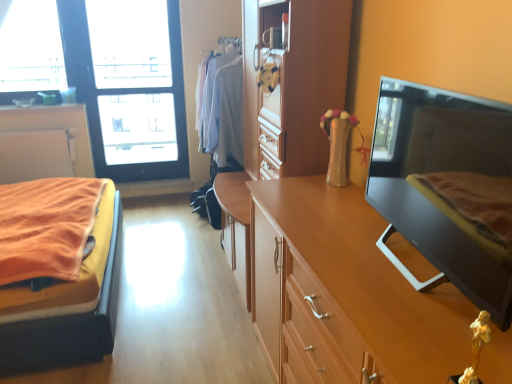
Question: Should I look upward or downward to see black glossy tv at right?

Choices:
 (A) up
 (B) down

Answer: (A)

Question: Does white matte radiator at left, the first cabinetry when ordered from top to bottom, have a greater height compared to black glossy tv at right?

Choices:
 (A) no
 (B) yes

Answer: (A)

Question: Is white matte radiator at left, which is the second cabinetry from bottom to top, behind black glossy tv at right?

Choices:
 (A) no
 (B) yes

Answer: (B)

Question: Is white matte radiator at left, marked as the second cabinetry in a front-to-back arrangement, closer to camera compared to black glossy tv at right?

Choices:
 (A) yes
 (B) no

Answer: (B)

Question: Can you confirm if white matte radiator at left, marked as the second cabinetry in a front-to-back arrangement, is smaller than black glossy tv at right?

Choices:
 (A) yes
 (B) no

Answer: (A)

Question: Is white matte radiator at left, which is the second cabinetry from bottom to top, at the right side of black glossy tv at right?

Choices:
 (A) yes
 (B) no

Answer: (B)

Question: Can you confirm if white matte radiator at left, the first cabinetry when ordered from top to bottom, is thinner than black glossy tv at right?

Choices:
 (A) no
 (B) yes

Answer: (B)

Question: Is transparent glass window at upper left positioned in front of white matte radiator at left, which is the first cabinetry from left to right?

Choices:
 (A) no
 (B) yes

Answer: (A)

Question: Is transparent glass window at upper left oriented towards white matte radiator at left, positioned as the first cabinetry in back-to-front order?

Choices:
 (A) yes
 (B) no

Answer: (B)

Question: Considering the relative sizes of transparent glass window at upper left and white matte radiator at left, the first cabinetry when ordered from top to bottom, in the image provided, is transparent glass window at upper left wider than white matte radiator at left, the first cabinetry when ordered from top to bottom,?

Choices:
 (A) no
 (B) yes

Answer: (B)

Question: Is there a large distance between transparent glass window at upper left and white matte radiator at left, marked as the second cabinetry in a front-to-back arrangement?

Choices:
 (A) no
 (B) yes

Answer: (A)

Question: Is transparent glass window at upper left next to white matte radiator at left, acting as the 2th cabinetry starting from the right?

Choices:
 (A) no
 (B) yes

Answer: (A)

Question: From a real-world perspective, is transparent glass window at upper left positioned over white matte radiator at left, positioned as the first cabinetry in back-to-front order, based on gravity?

Choices:
 (A) yes
 (B) no

Answer: (A)

Question: From a real-world perspective, is black glossy tv at right positioned under wooden dresser at center based on gravity?

Choices:
 (A) yes
 (B) no

Answer: (B)